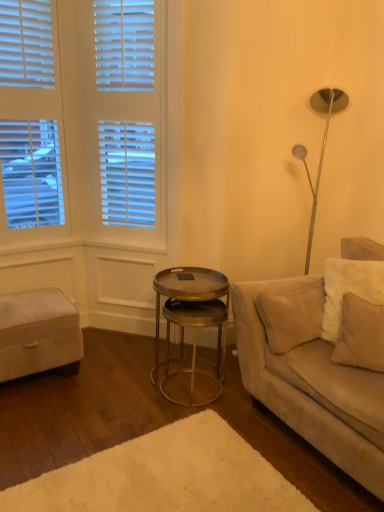
Question: Could you tell me if beige fabric pillow at right is turned towards white fabric ottoman at lower left?

Choices:
 (A) yes
 (B) no

Answer: (B)

Question: Is beige fabric pillow at right taller than white fabric ottoman at lower left?

Choices:
 (A) no
 (B) yes

Answer: (B)

Question: Is beige fabric pillow at right shorter than white fabric ottoman at lower left?

Choices:
 (A) no
 (B) yes

Answer: (A)

Question: Does beige fabric pillow at right lie behind white fabric ottoman at lower left?

Choices:
 (A) no
 (B) yes

Answer: (A)

Question: From a real-world perspective, is beige fabric pillow at right on top of white fabric ottoman at lower left?

Choices:
 (A) yes
 (B) no

Answer: (A)

Question: From the image's perspective, is beige fabric pillow at right above white fabric ottoman at lower left?

Choices:
 (A) no
 (B) yes

Answer: (B)

Question: Is white plush rug at lower center facing towards white fabric ottoman at lower left?

Choices:
 (A) no
 (B) yes

Answer: (A)

Question: Can you confirm if white plush rug at lower center is smaller than white fabric ottoman at lower left?

Choices:
 (A) no
 (B) yes

Answer: (B)

Question: Considering the relative positions of white plush rug at lower center and white fabric ottoman at lower left in the image provided, is white plush rug at lower center to the right of white fabric ottoman at lower left from the viewer's perspective?

Choices:
 (A) yes
 (B) no

Answer: (A)

Question: Are white plush rug at lower center and white fabric ottoman at lower left located far from each other?

Choices:
 (A) yes
 (B) no

Answer: (B)

Question: From a real-world perspective, is white plush rug at lower center located beneath white fabric ottoman at lower left?

Choices:
 (A) yes
 (B) no

Answer: (A)

Question: From the image's perspective, would you say white plush rug at lower center is shown under white fabric ottoman at lower left?

Choices:
 (A) yes
 (B) no

Answer: (A)

Question: From the image's perspective, does white plush rug at lower center appear lower than suede beige couch at right?

Choices:
 (A) yes
 (B) no

Answer: (A)